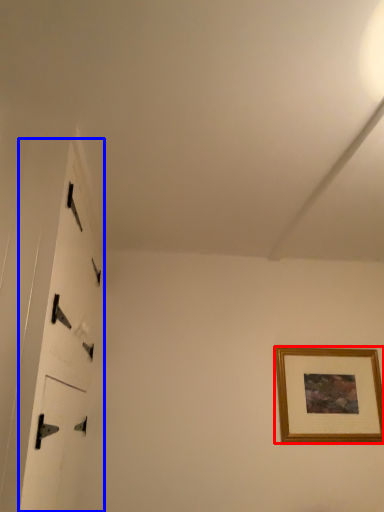
Question: Among these objects, which one is nearest to the camera, picture frame (highlighted by a red box) or door (highlighted by a blue box)?

Choices:
 (A) picture frame
 (B) door

Answer: (B)